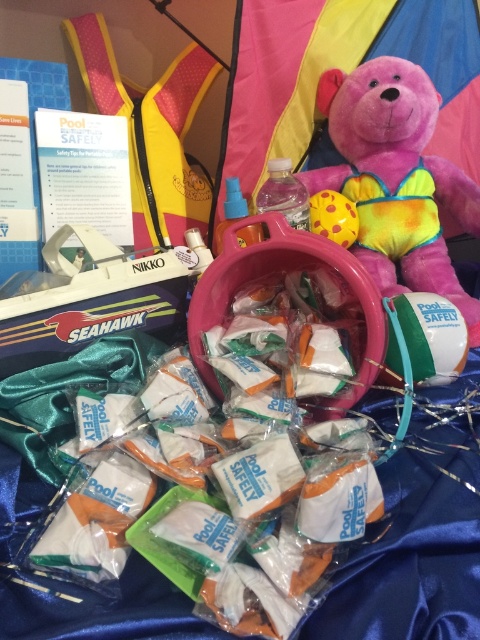
You are setting up a poolside activity and have a white plastic bucket at center and a yellow rubber ball at center. Which object is closer to you when standing at the front of the setup?

The white plastic bucket at center is closer to you because it is in front of the yellow rubber ball at center.

You are a child looking at the image. You see a pink plush bear at center and a yellow rubber ball at center. Which object is higher up?

The pink plush bear at center is higher up than the yellow rubber ball at center.

You are setting up a pool safety display and have a white plastic bucket at center and a yellow rubber ball at center. Which object is taller?

The white plastic bucket at center is taller than the yellow rubber ball at center according to the description.